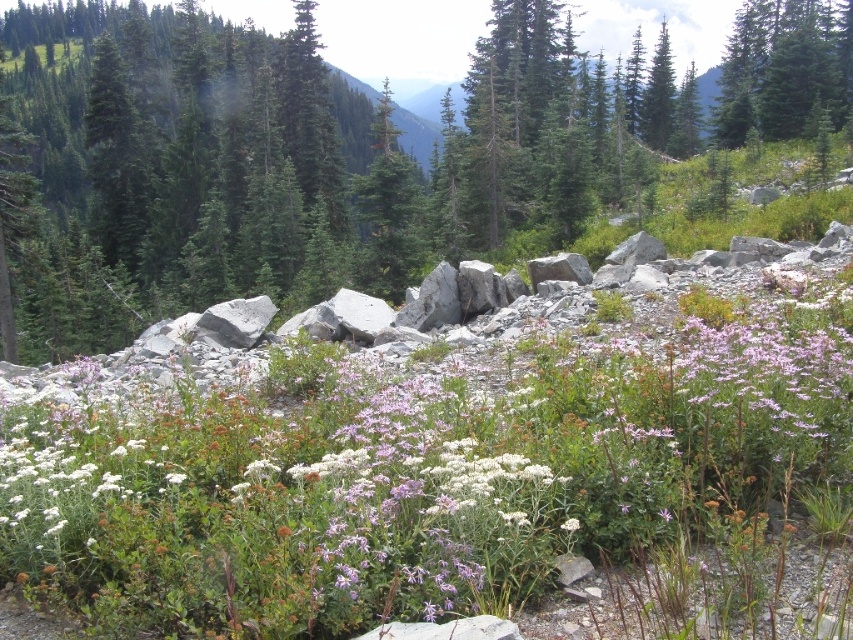
Question: Considering the relative positions of green matte tree at center and green matte tree at upper right in the image provided, where is green matte tree at center located with respect to green matte tree at upper right?

Choices:
 (A) right
 (B) left

Answer: (B)

Question: Is green matte tree at center to the left of white fluffy flower at center from the viewer's perspective?

Choices:
 (A) yes
 (B) no

Answer: (A)

Question: Which object is the closest to the green matte tree at upper right?

Choices:
 (A) white soft flower at center
 (B) green matte tree at center
 (C) white fluffy flower at center

Answer: (A)

Question: Which object is positioned farthest from the green matte tree at upper right?

Choices:
 (A) white soft flower at center
 (B) white fluffy flower at center
 (C) green matte tree at center

Answer: (B)

Question: Which point is farther from the camera taking this photo?

Choices:
 (A) (560, 528)
 (B) (62, 534)
 (C) (819, 44)

Answer: (C)

Question: In this image, where is white soft flower at center located relative to green matte tree at upper right?

Choices:
 (A) below
 (B) above

Answer: (A)